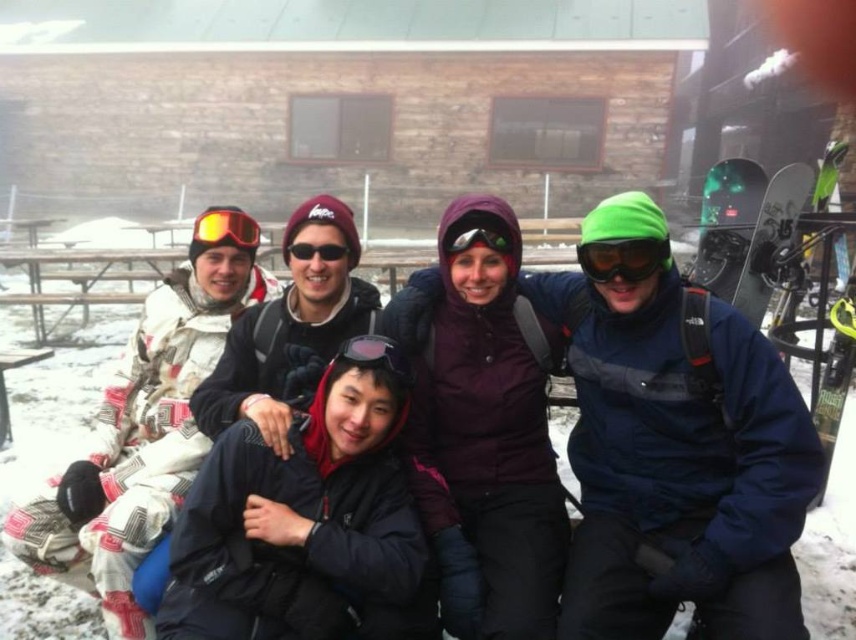
Who is positioned more to the left, sunglasses at center or matte black goggles at center?

Positioned to the left is sunglasses at center.

Consider the image. Does sunglasses at center have a smaller size compared to matte black goggles at center?

No, sunglasses at center is not smaller than matte black goggles at center.

Locate an element on the screen. sunglasses at center is located at coordinates (373, 355).

Locate an element on the screen. sunglasses at center is located at coordinates [373, 355].

Does black matte jacket at center have a lesser height compared to green matte goggles at center?

No.

Does point (164, 625) come farther from viewer compared to point (627, 273)?

That is False.

In order to click on black matte jacket at center in this screenshot , I will do `click(304, 529)`.

Locate an element on the screen. black matte jacket at center is located at coordinates (304, 529).

Is black matte goggles at center above matte black goggles at center?

No, black matte goggles at center is not above matte black goggles at center.

Between black matte goggles at center and matte black goggles at center, which one is positioned lower?

black matte goggles at center is lower down.

Image resolution: width=856 pixels, height=640 pixels. What are the coordinates of `black matte goggles at center` in the screenshot? It's located at (316, 252).